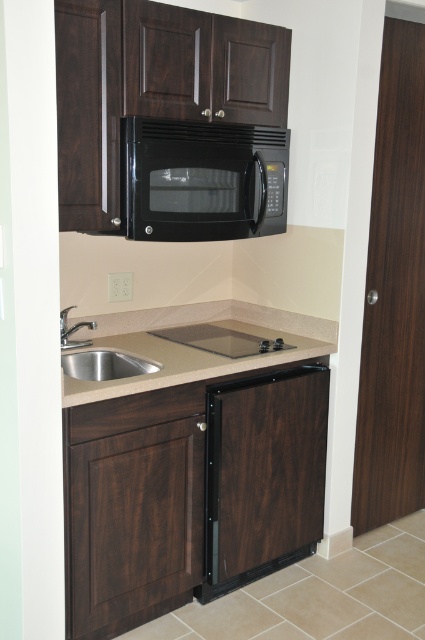
You are preparing to place a large cutting board on the beige laminate countertop at lower center. However, you notice the stainless steel sink at lower left is directly behind it. Will the cutting board extend over the sink if placed on the countertop?

The beige laminate countertop at lower center is in front of the stainless steel sink at lower left, so placing the cutting board on the countertop would not cause it to extend over the sink since they are positioned in a front and back arrangement.

You are preparing to place a large cutting board on the beige laminate countertop at lower center and the stainless steel sink at lower left. Which surface has enough space to accommodate the board without overhanging?

The beige laminate countertop at lower center is larger in size than the stainless steel sink at lower left, so the cutting board can be placed on the beige laminate countertop at lower center without overhanging.